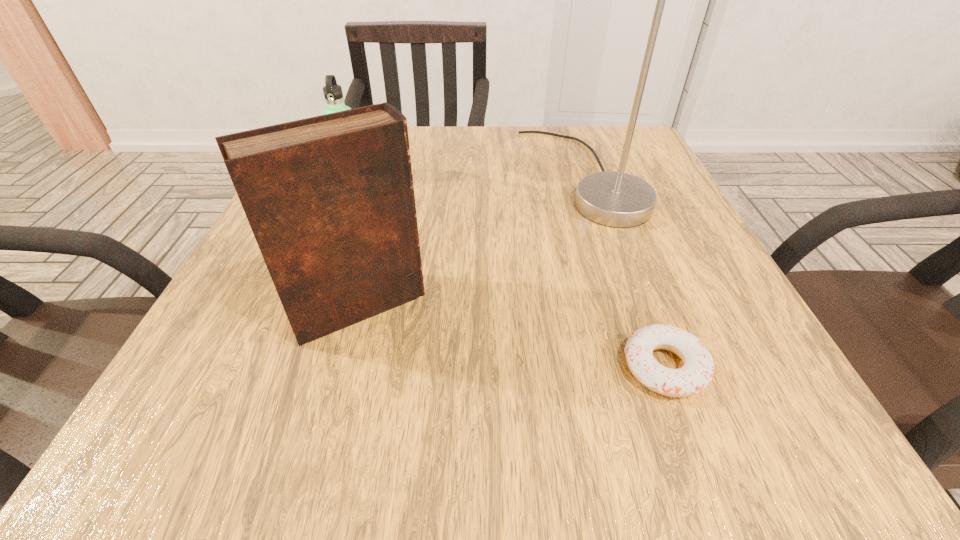
What are the coordinates of `object that is at the near edge` in the screenshot? It's located at (698, 370).

Identify the location of Bible that is at the left edge. This screenshot has width=960, height=540. (330, 200).

Locate an element on the screen. Image resolution: width=960 pixels, height=540 pixels. thermos bottle that is at the left edge is located at coordinates (333, 94).

This screenshot has height=540, width=960. I want to click on table lamp situated at the right edge, so click(x=613, y=199).

Locate an element on the screen. This screenshot has width=960, height=540. doughnut present at the right edge is located at coordinates (698, 370).

At what (x,y) coordinates should I click in order to perform the action: click on object at the far left corner. Please return your answer as a coordinate pair (x, y). Looking at the image, I should click on (333, 94).

Where is `object that is positioned at the far right corner`? This screenshot has height=540, width=960. object that is positioned at the far right corner is located at coordinates (613, 199).

This screenshot has width=960, height=540. What are the coordinates of `object present at the near right corner` in the screenshot? It's located at (698, 370).

The image size is (960, 540). In order to click on vacant area at the far edge in this screenshot , I will do `click(530, 128)`.

In the image, there is a desktop. What are the coordinates of `vacant space at the near edge` in the screenshot? It's located at (519, 431).